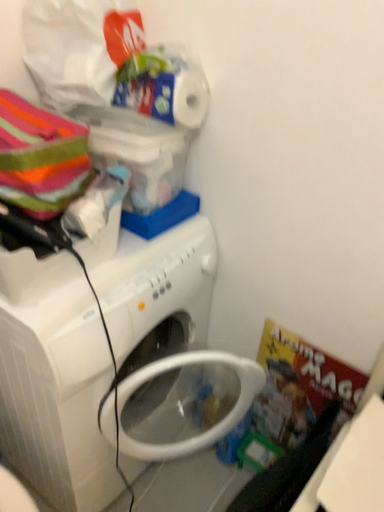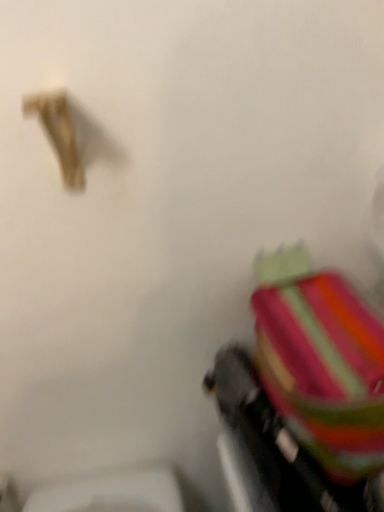
Question: How did the camera likely rotate when shooting the video?

Choices:
 (A) rotated upward
 (B) rotated downward

Answer: (A)